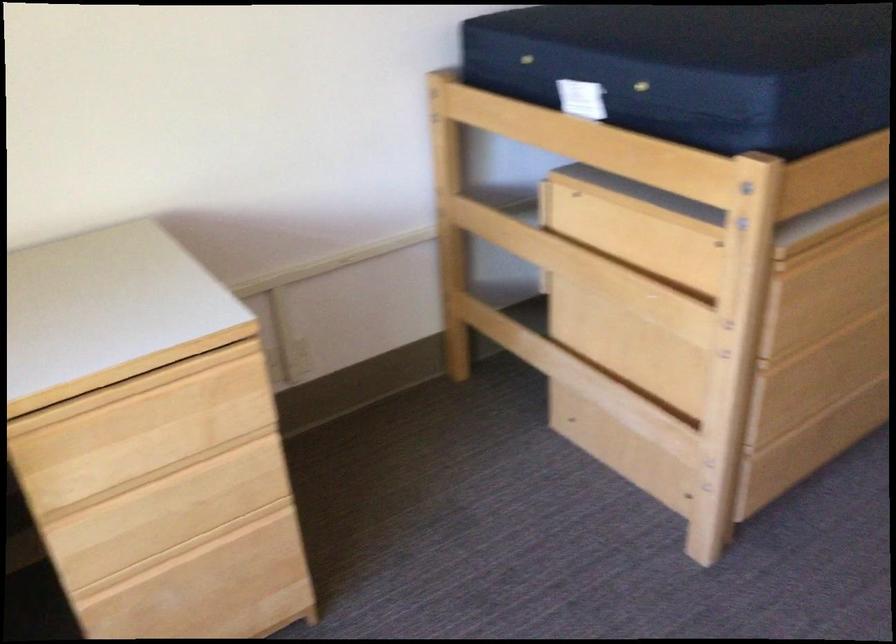
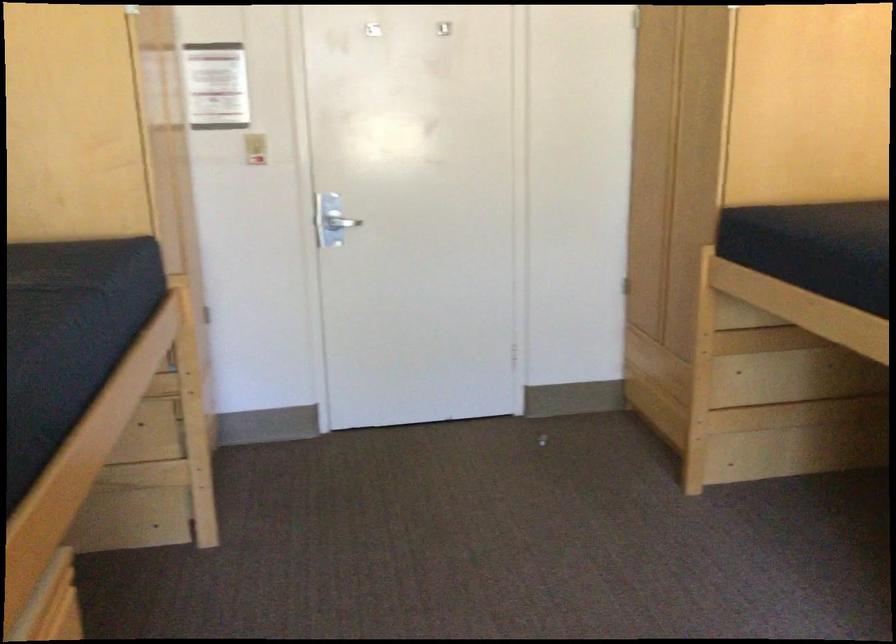
Question: The camera is either moving clockwise (left) or counter-clockwise (right) around the object. The first image is from the beginning of the video and the second image is from the end. Is the camera moving left or right when shooting the video?

Choices:
 (A) Left
 (B) Right

Answer: (A)